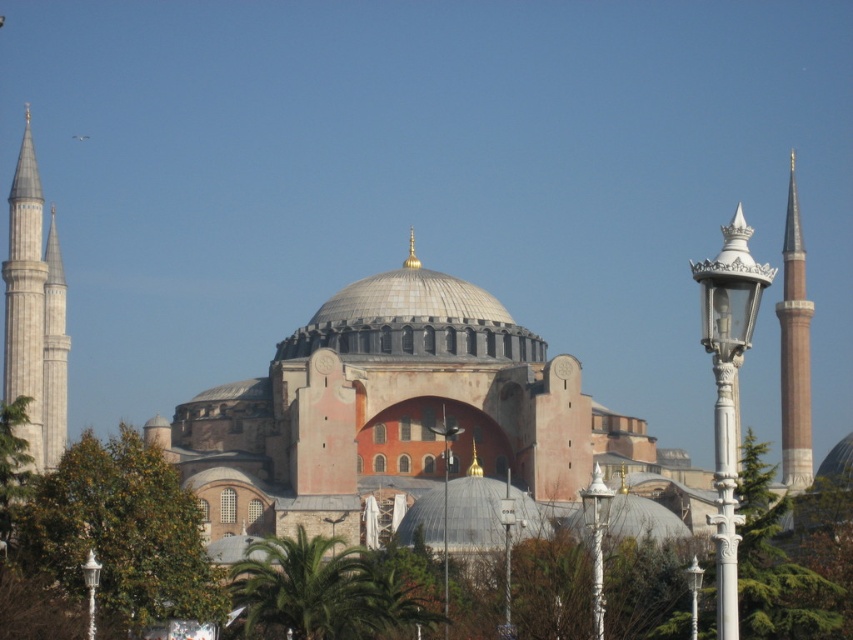
Does gray stone minaret at left have a lesser height compared to brown stone minaret at right?

Indeed, gray stone minaret at left has a lesser height compared to brown stone minaret at right.

Does point (64, 424) come in front of point (796, 227)?

Yes, it is in front of point (796, 227).

Between point (30, 314) and point (782, 403), which one is positioned in front?

Point (30, 314)

Locate an element on the screen. gray stone minaret at left is located at coordinates coord(33,314).

Is golden mosaic dome at center smaller than gray stone minaret at left?

Indeed, golden mosaic dome at center has a smaller size compared to gray stone minaret at left.

Does golden mosaic dome at center have a lesser height compared to gray stone minaret at left?

Indeed, golden mosaic dome at center has a lesser height compared to gray stone minaret at left.

Which is in front, point (380, 340) or point (15, 362)?

Positioned in front is point (15, 362).

You are a GUI agent. You are given a task and a screenshot of the screen. Output one action in this format:
    pyautogui.click(x=<x>, y=<y>)
    Task: Click on the golden mosaic dome at center
    This screenshot has width=853, height=640.
    Given the screenshot: What is the action you would take?
    pyautogui.click(x=413, y=320)

Does green leafy tree at lower left come in front of brown stone minaret at right?

Yes, green leafy tree at lower left is closer to the viewer.

Is point (99, 528) farther from camera compared to point (792, 243)?

No, (99, 528) is closer to viewer.

Who is more distant from viewer, (148, 467) or (808, 323)?

Positioned behind is point (808, 323).

Identify the location of green leafy tree at lower left. tap(120, 534).